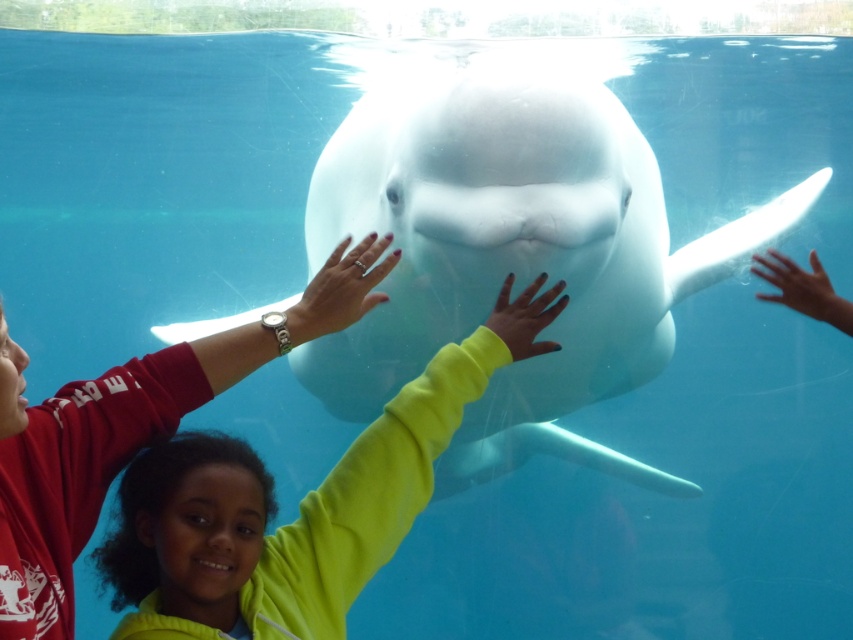
Question: Does white smooth whale at center have a smaller size compared to neon yellow sweater at center?

Choices:
 (A) yes
 (B) no

Answer: (B)

Question: Does white smooth whale at center come in front of neon yellow sweater at center?

Choices:
 (A) yes
 (B) no

Answer: (B)

Question: Does white smooth whale at center have a larger size compared to neon yellow sweater at center?

Choices:
 (A) no
 (B) yes

Answer: (B)

Question: Which object appears farthest from the camera in this image?

Choices:
 (A) white smooth whale at center
 (B) neon yellow sweater at center

Answer: (A)